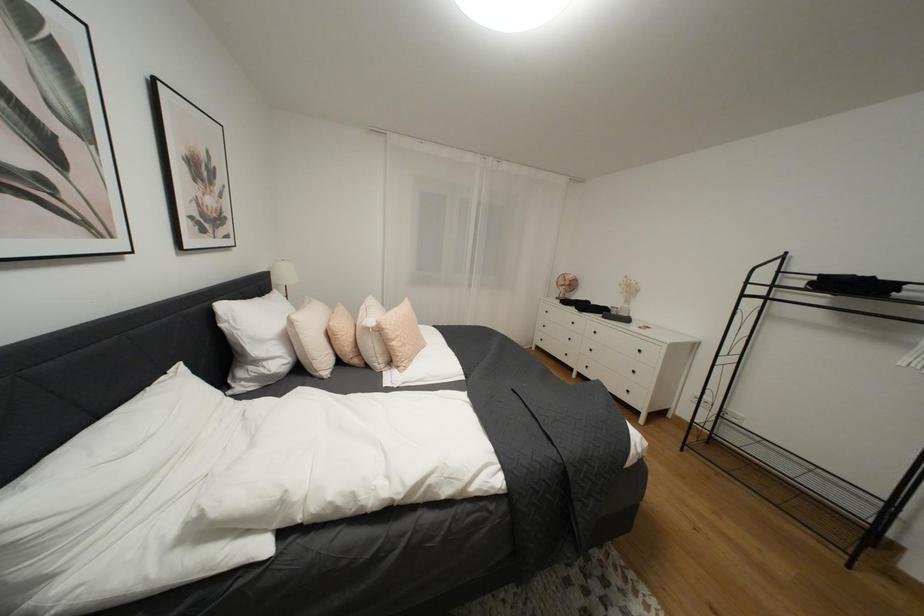
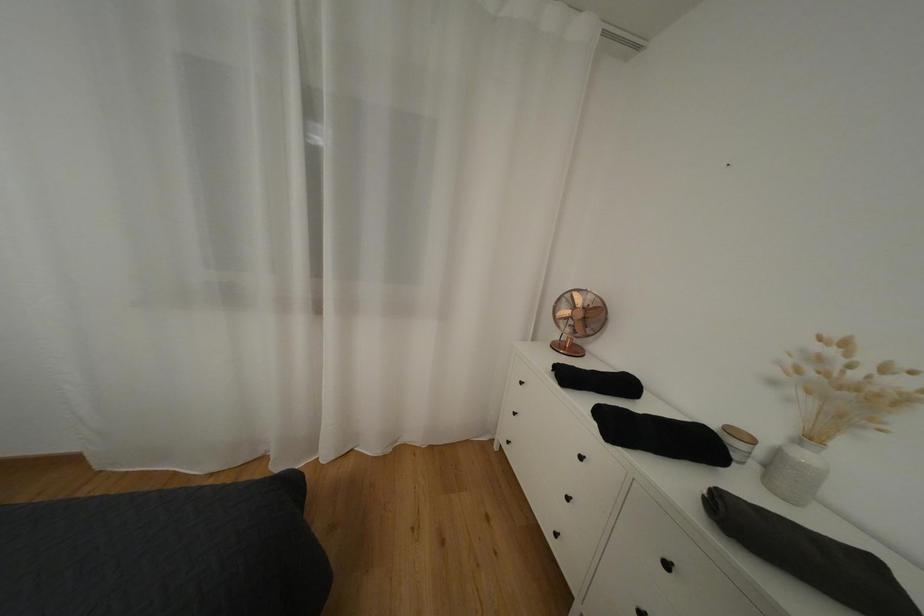
From the picture: The images are taken continuously from a first-person perspective. In which direction are you moving?

The cameraman moved toward right, forward.